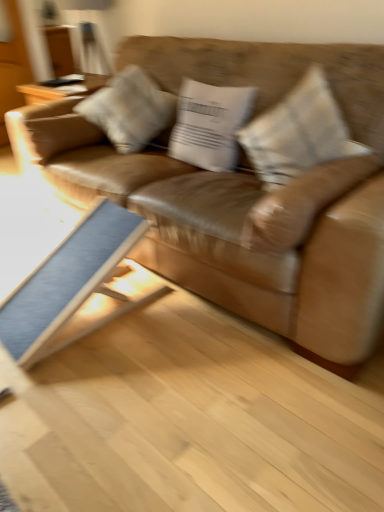
Question: Is blue fabric table at lower left further to camera compared to textured beige pillow at center, acting as the 1th pillow starting from the right?

Choices:
 (A) no
 (B) yes

Answer: (A)

Question: Can you confirm if blue fabric table at lower left is thinner than textured beige pillow at center, which is the 3th pillow in left-to-right order?

Choices:
 (A) no
 (B) yes

Answer: (A)

Question: From a real-world perspective, does blue fabric table at lower left stand above textured beige pillow at center, which is the 3th pillow in left-to-right order?

Choices:
 (A) yes
 (B) no

Answer: (B)

Question: Is blue fabric table at lower left to the right of textured beige pillow at center, acting as the 1th pillow starting from the right, from the viewer's perspective?

Choices:
 (A) yes
 (B) no

Answer: (B)

Question: From the image's perspective, does blue fabric table at lower left appear higher than textured beige pillow at center, which is the 3th pillow in left-to-right order?

Choices:
 (A) yes
 (B) no

Answer: (B)

Question: Can you confirm if blue fabric table at lower left is taller than textured beige pillow at center, acting as the 1th pillow starting from the right?

Choices:
 (A) no
 (B) yes

Answer: (A)

Question: Can you confirm if light gray fabric pillow at center, the first pillow in the left-to-right sequence, is taller than blue fabric table at lower left?

Choices:
 (A) yes
 (B) no

Answer: (A)

Question: Are light gray fabric pillow at center, the first pillow in the left-to-right sequence, and blue fabric table at lower left beside each other?

Choices:
 (A) yes
 (B) no

Answer: (B)

Question: From the image's perspective, would you say light gray fabric pillow at center, the first pillow in the left-to-right sequence, is positioned over blue fabric table at lower left?

Choices:
 (A) yes
 (B) no

Answer: (A)

Question: Considering the relative sizes of light gray fabric pillow at center, the first pillow in the left-to-right sequence, and blue fabric table at lower left in the image provided, is light gray fabric pillow at center, the first pillow in the left-to-right sequence, shorter than blue fabric table at lower left?

Choices:
 (A) yes
 (B) no

Answer: (B)

Question: From the image's perspective, does light gray fabric pillow at center, arranged as the third pillow when viewed from the right, appear lower than blue fabric table at lower left?

Choices:
 (A) no
 (B) yes

Answer: (A)

Question: From a real-world perspective, is light gray fabric pillow at center, the first pillow in the left-to-right sequence, on blue fabric table at lower left?

Choices:
 (A) no
 (B) yes

Answer: (B)

Question: Is brown leather couch at center completely or partially inside blue fabric table at lower left?

Choices:
 (A) yes
 (B) no

Answer: (B)